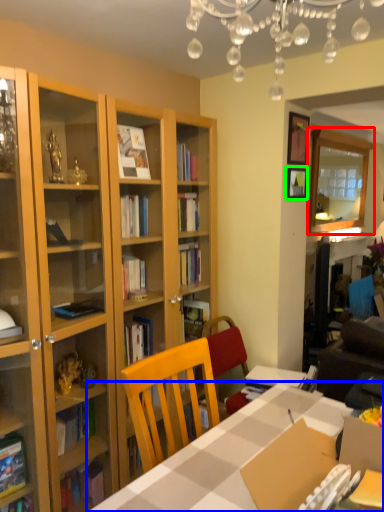
Question: Which is nearer to the glass door (highlighted by a red box)? table (highlighted by a blue box) or picture frame (highlighted by a green box).

Choices:
 (A) table
 (B) picture frame

Answer: (B)